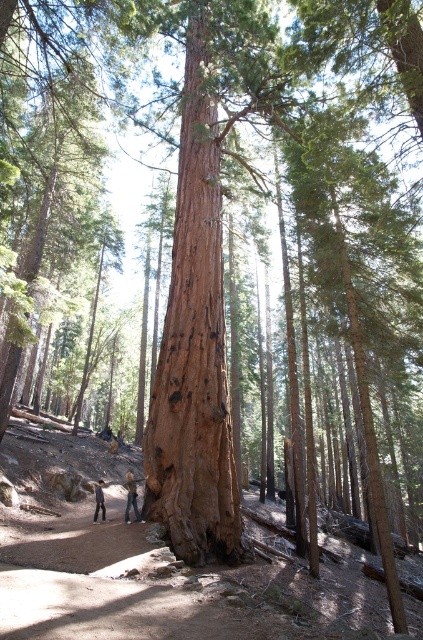
Consider the image. You are a hiker who wants to cross a narrow path between two denim jeans. The path is between the denim jeans at center and the denim jeans at lower center. Which denim jeans should you avoid stepping on to stay on the path?

The denim jeans at center is shorter than the denim jeans at lower center. To stay on the path, avoid stepping on the denim jeans at lower center since it is taller and might block the path.

You are a hiker standing at the base of the towering sequoia tree. You see two points marked on the tree trunk. The first point is at coordinate point (128,512) and the second is at point (95,516). Which point is closer to you?

Point (128,512) is closer to the viewer than point (95,516).